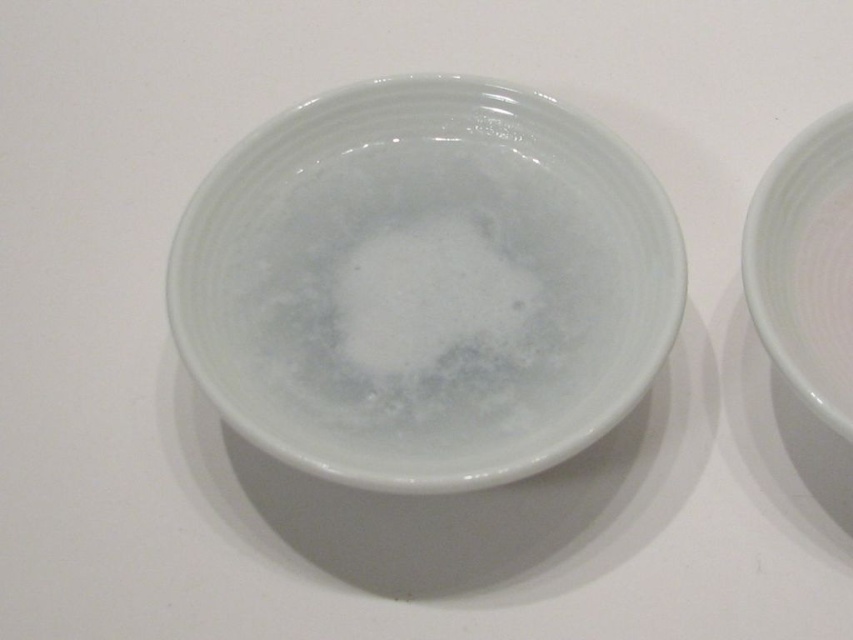
You are standing 5 feet away from the white ceramic bowls. If you want to reach the point at coordinates point (x=503, y=332), will you be able to reach it without moving closer?

The distance of point (x=503, y=332) from viewer is 3.94 feet, so yes, you can reach it without moving closer since it is within your 5 feet distance.

You are a chef preparing a dish and need to place the white frothy foam at center onto the glossy ceramic bowl at center. Based on the image, can you determine if the foam will fit inside the bowl?

The glossy ceramic bowl at center is above the white frothy foam at center, which suggests the foam is below the bowl. Since the bowl is above, the foam might not be inside it yet. To place the foam into the bowl, you would need to move it upwards so it sits within the bowl.

You are standing in front of a table with two white ceramic bowls. You need to place a small decorative item exactly at the center of the glossy ceramic bowl at center. Where should you place it?

You should place the item at the coordinates point (407,218), which is the center of the glossy ceramic bowl at center.